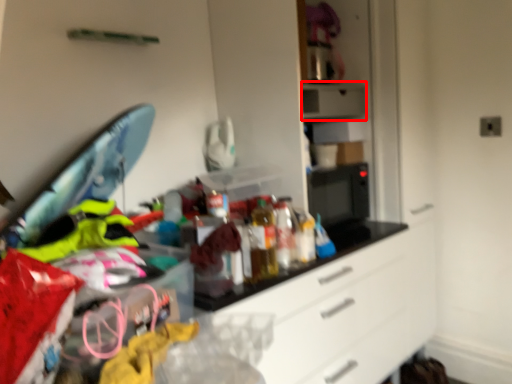
Question: From the image's perspective, where is appliance (annotated by the red box) located relative to bottle?

Choices:
 (A) below
 (B) above

Answer: (B)